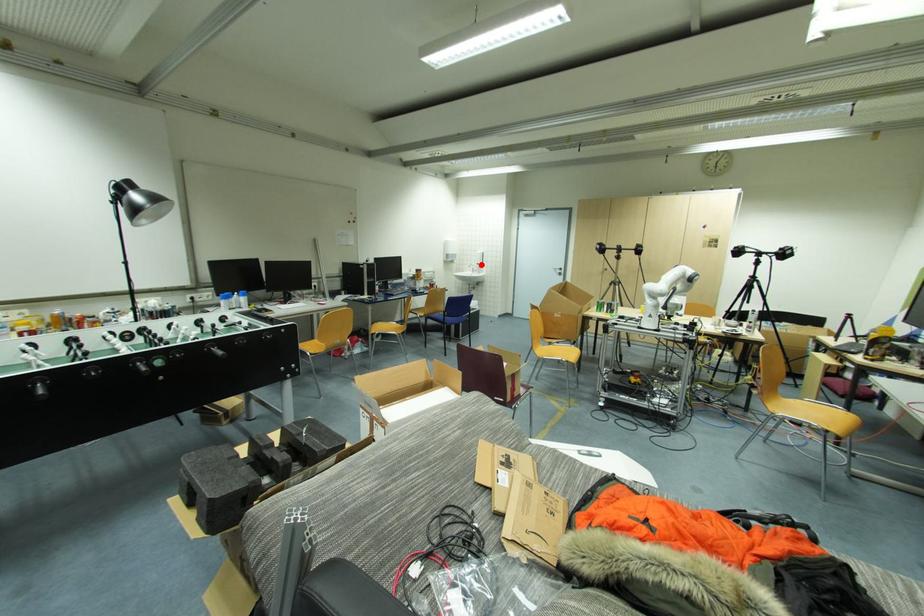
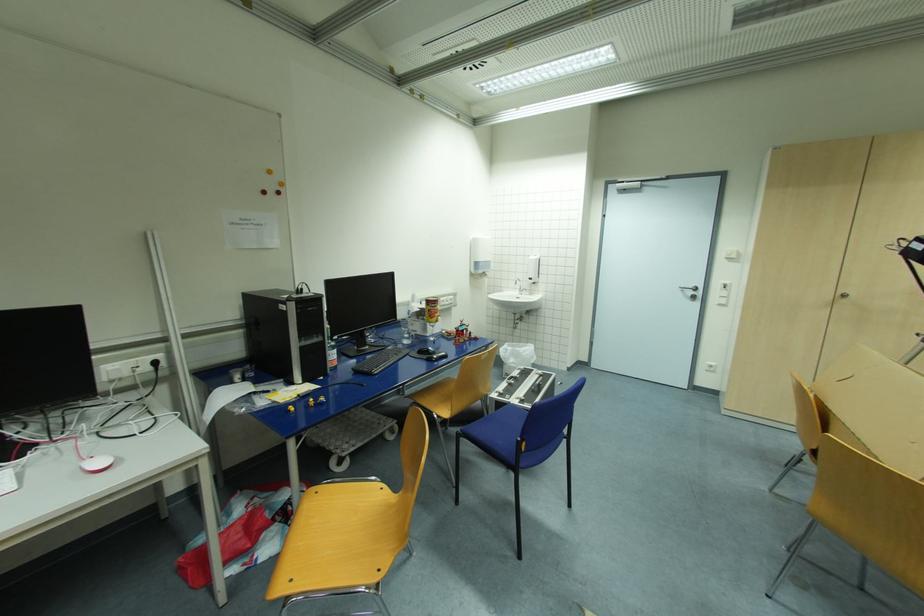
The point at the highlighted location is marked in the first image. Where is the corresponding point in the second image?

(533, 280)